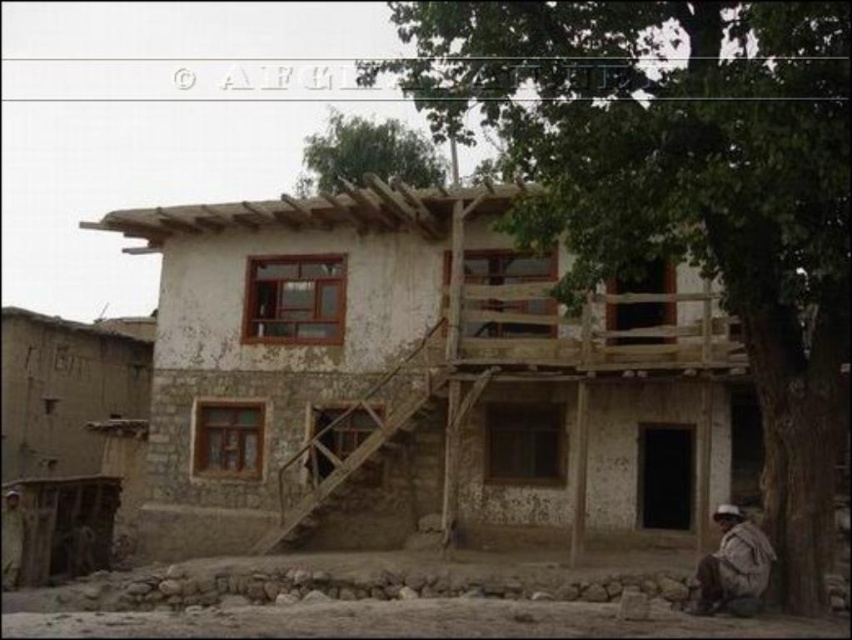
Does green leafy tree at upper right appear over brown textured fabric at lower left?

Indeed, green leafy tree at upper right is positioned over brown textured fabric at lower left.

Which is below, green leafy tree at upper right or brown textured fabric at lower left?

Positioned lower is brown textured fabric at lower left.

Who is more forward, (x=757, y=252) or (x=16, y=580)?

Point (x=757, y=252) is in front.

Locate an element on the screen. This screenshot has width=852, height=640. green leafy tree at upper right is located at coordinates (681, 188).

Which is behind, point (583, 52) or point (371, 152)?

Positioned behind is point (371, 152).

Between point (617, 228) and point (314, 172), which one is positioned behind?

The point (314, 172) is more distant.

The height and width of the screenshot is (640, 852). Find the location of `green leafy tree at upper right`. green leafy tree at upper right is located at coordinates (681, 188).

This screenshot has width=852, height=640. What are the coordinates of `brown fabric hat at lower right` in the screenshot? It's located at (732, 563).

At what (x,y) coordinates should I click in order to perform the action: click on brown fabric hat at lower right. Please return your answer as a coordinate pair (x, y). The width and height of the screenshot is (852, 640). Looking at the image, I should click on (732, 563).

Locate an element on the screen. brown fabric hat at lower right is located at coordinates (732, 563).